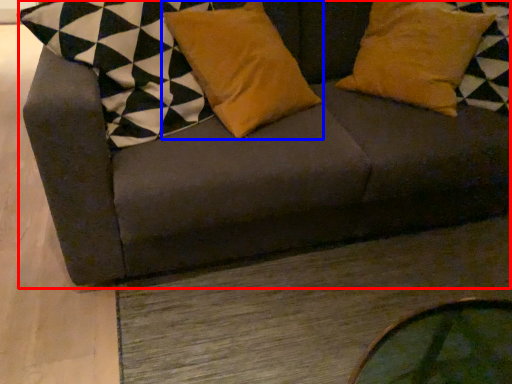
Question: Which object is closer to the camera taking this photo, studio couch (highlighted by a red box) or pillow (highlighted by a blue box)?

Choices:
 (A) studio couch
 (B) pillow

Answer: (A)